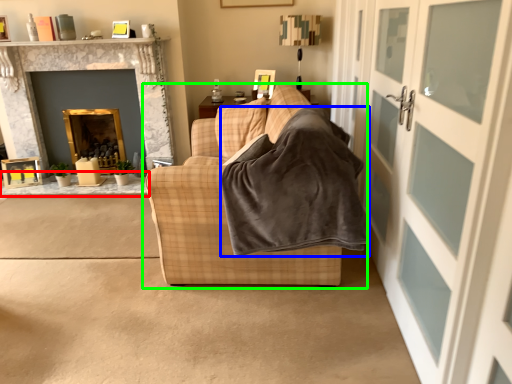
Question: Estimate the real-world distances between objects in this image. Which object is farther from table (highlighted by a red box), blanket (highlighted by a blue box) or studio couch (highlighted by a green box)?

Choices:
 (A) blanket
 (B) studio couch

Answer: (A)